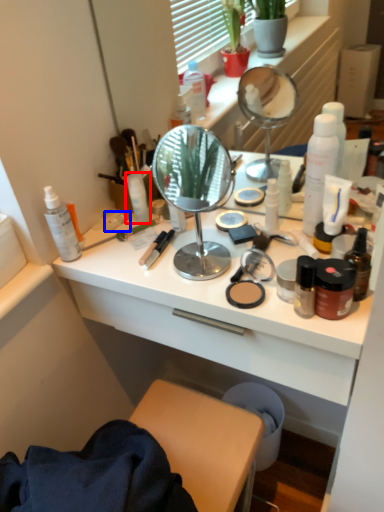
Question: Among these objects, which one is farthest to the camera, toiletry (highlighted by a red box) or toiletry (highlighted by a blue box)?

Choices:
 (A) toiletry
 (B) toiletry

Answer: (B)